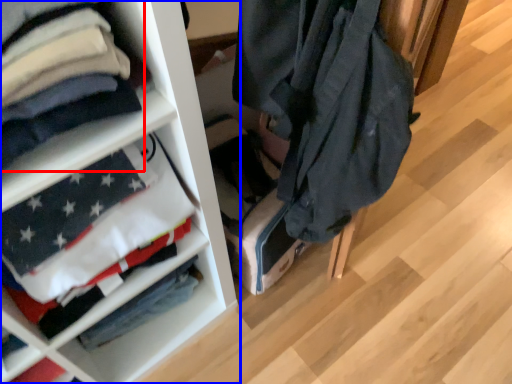
Question: Among these objects, which one is nearest to the camera, cloak (highlighted by a red box) or shelf (highlighted by a blue box)?

Choices:
 (A) cloak
 (B) shelf

Answer: (A)